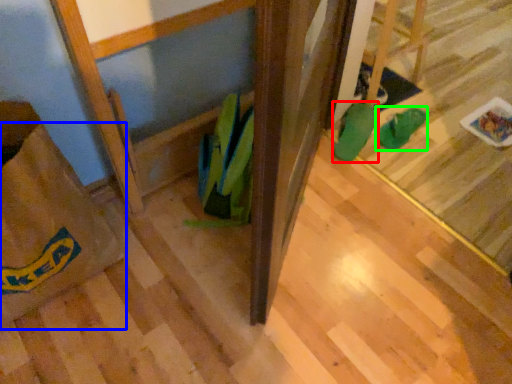
Question: Which is nearer to the footwear (highlighted by a red box)? grocery bag (highlighted by a blue box) or footwear (highlighted by a green box).

Choices:
 (A) grocery bag
 (B) footwear

Answer: (B)